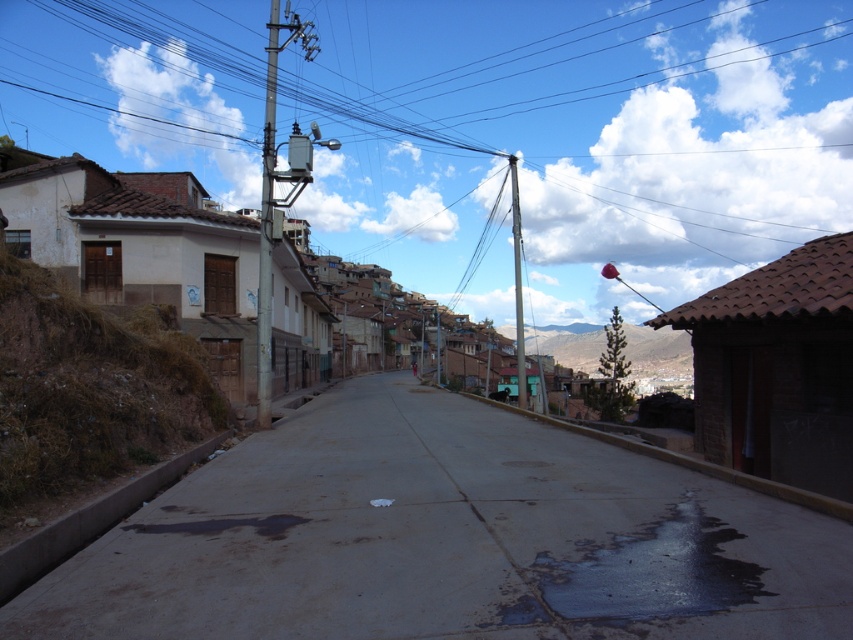
Question: Which object is the closest to the silver metallic telegraph pole at center-left?

Choices:
 (A) white stucco building at left
 (B) metallic gray power line at upper center
 (C) metallic gray pole at center-right
 (D) concrete utility pole at center-left

Answer: (D)

Question: Which point is farther to the camera?

Choices:
 (A) smooth concrete alley at center
 (B) white stucco building at left
 (C) metallic gray power line at upper center
 (D) silver metallic telegraph pole at center-left

Answer: (C)

Question: Which object is positioned closest to the metallic gray power line at upper center?

Choices:
 (A) smooth concrete alley at center
 (B) concrete utility pole at center-left
 (C) silver metallic telegraph pole at center-left
 (D) metallic gray pole at center-right

Answer: (D)

Question: Is metallic gray power line at upper center to the right of silver metallic telegraph pole at center-left from the viewer's perspective?

Choices:
 (A) yes
 (B) no

Answer: (A)

Question: Is concrete utility pole at center-left positioned before metallic gray pole at center-right?

Choices:
 (A) yes
 (B) no

Answer: (A)

Question: Is metallic gray power line at upper center below white stucco building at left?

Choices:
 (A) yes
 (B) no

Answer: (B)